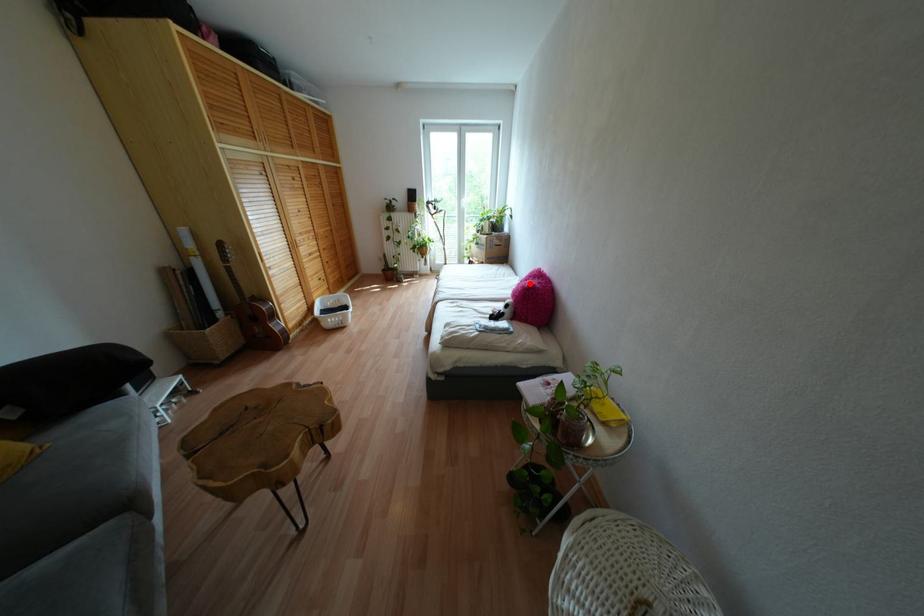
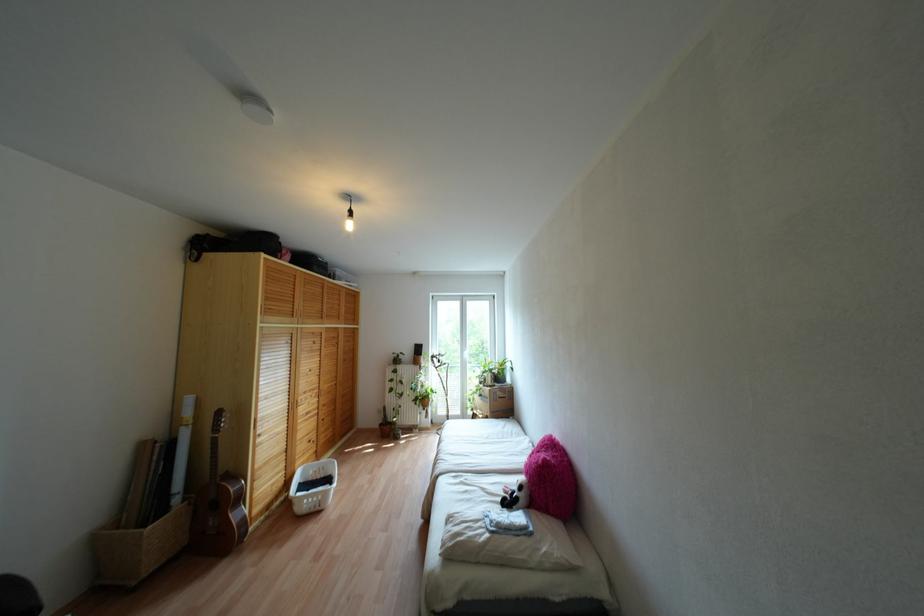
Question: I am providing you with two images of the same scene from different viewpoints. Given a red point in image1, look at the same physical point in image2. Is it:

Choices:
 (A) Closer to the viewpoint
 (B) Farther from the viewpoint

Answer: (A)